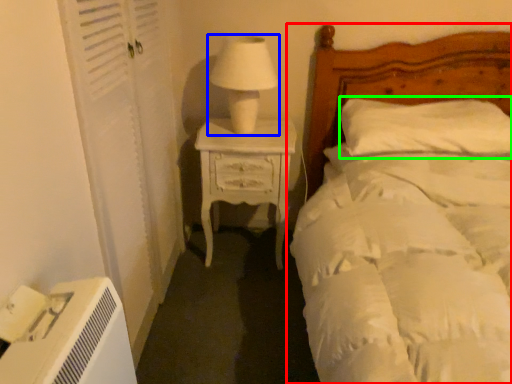
Question: Which object is positioned closest to bed (highlighted by a red box)? Select from table lamp (highlighted by a blue box) and pillow (highlighted by a green box).

Choices:
 (A) table lamp
 (B) pillow

Answer: (B)